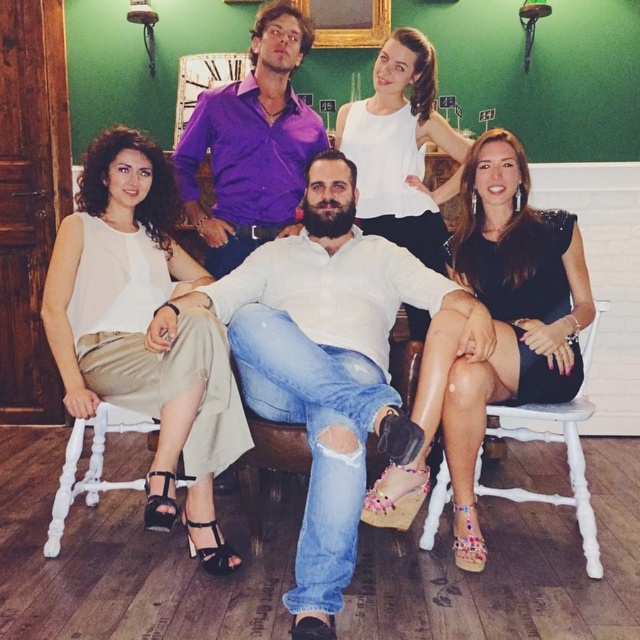
You are a photographer setting up for a group photo. You notice the black suede sandal at lower center and the ripped denim jeans at center. Which object is positioned more to the left side of the scene?

The black suede sandal at lower center is positioned more to the left side of the scene than the ripped denim jeans at center.

In the scene shown: You are standing in the room and want to hand a gift to the person wearing the purple satin shirt at upper center. If your maximum reaching distance is 2 meters, can you reach them without moving?

The purple satin shirt at upper center is 2.67 meters away from the viewer. Since your maximum reaching distance is 2 meters, you cannot reach them without moving closer.

You are a shoe designer observing the image. You need to create a new sandal design that accommodates the width of the pink fabric sandal at lower center and the ripped denim jeans at center. Which object should you consider for the width measurement?

The pink fabric sandal at lower center might be wider than the ripped denim jeans at center, so you should consider the width of the pink fabric sandal at lower center to ensure the design accommodates the wider measurement.